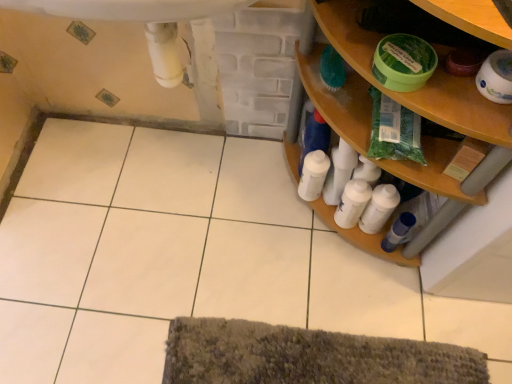
Where is `free region on the left part of wooden shelf at right`? Image resolution: width=512 pixels, height=384 pixels. free region on the left part of wooden shelf at right is located at coordinates (227, 208).